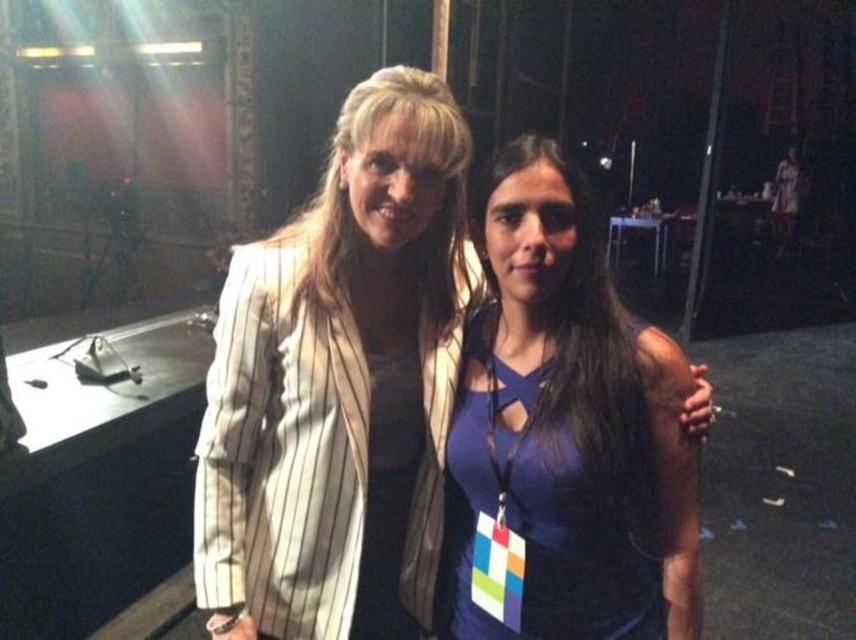
Is point (383, 97) farther from viewer compared to point (491, 387)?

No, it is in front of (491, 387).

Does white pinstriped blazer at center appear under purple matte dress at center?

No, white pinstriped blazer at center is not below purple matte dress at center.

Describe the element at coordinates (340, 385) in the screenshot. I see `white pinstriped blazer at center` at that location.

Where is `white pinstriped blazer at center`? The image size is (856, 640). white pinstriped blazer at center is located at coordinates (340, 385).